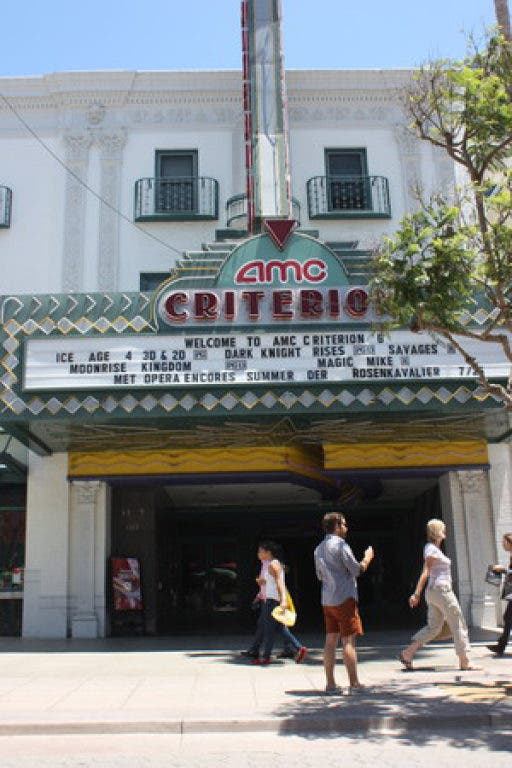
At what (x,y) coordinates should I click in order to perform the action: click on looks like the entrance doorway. Please return your answer as a coordinate pair (x, y). The height and width of the screenshot is (768, 512). Looking at the image, I should click on (203, 581).